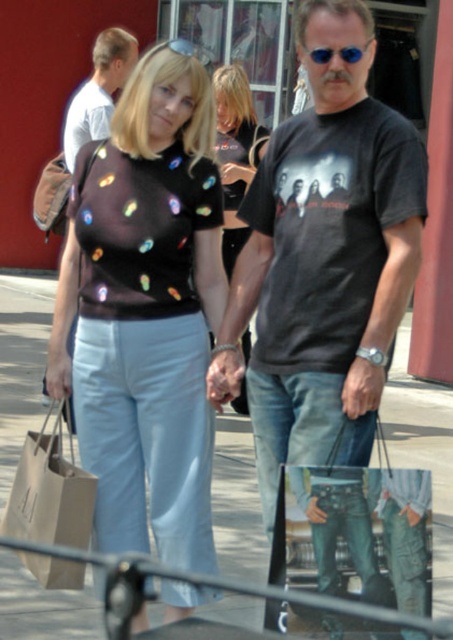
Which is above, light gray concrete sidewalk at center or light brown hair at upper left?

light brown hair at upper left is above.

Find the location of `light gray concrete sidewalk at center`. light gray concrete sidewalk at center is located at coordinates (424, 452).

Can you confirm if light brown hair at upper left is thinner than blue reflective sunglasses at center?

Incorrect, light brown hair at upper left's width is not less than blue reflective sunglasses at center's.

Between light brown hair at upper left and blue reflective sunglasses at center, which one is positioned lower?

Positioned lower is blue reflective sunglasses at center.

Which is in front, point (120, 68) or point (319, 52)?

Point (319, 52) is more forward.

At what (x,y) coordinates should I click in order to perform the action: click on light brown hair at upper left. Please return your answer as a coordinate pair (x, y). Image resolution: width=453 pixels, height=640 pixels. Looking at the image, I should click on (99, 92).

Based on the photo, does matte black top at center have a larger size compared to light brown hair at upper left?

Incorrect, matte black top at center is not larger than light brown hair at upper left.

Does matte black top at center come behind light brown hair at upper left?

No, matte black top at center is closer to the viewer.

The width and height of the screenshot is (453, 640). Describe the element at coordinates (236, 152) in the screenshot. I see `matte black top at center` at that location.

I want to click on matte black top at center, so click(236, 152).